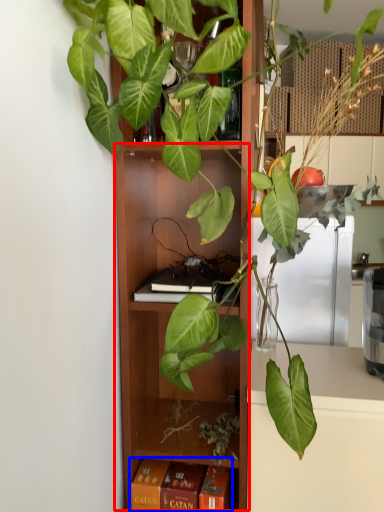
Question: Among these objects, which one is farthest to the camera, cabinet (highlighted by a red box) or paperback book (highlighted by a blue box)?

Choices:
 (A) cabinet
 (B) paperback book

Answer: (B)